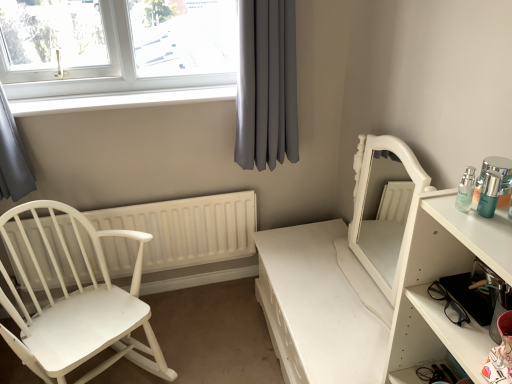
Measure the distance between point (x=286, y=155) and camera.

Point (x=286, y=155) is 1.84 meters away from camera.

Image resolution: width=512 pixels, height=384 pixels. Find the location of `white glossy mirror at right`. white glossy mirror at right is located at coordinates (384, 208).

Measure the distance between point (x=267, y=231) and camera.

The distance of point (x=267, y=231) from camera is 6.66 feet.

This screenshot has width=512, height=384. What are the coordinates of `white glossy window sill at upper left` in the screenshot? It's located at (121, 100).

Where is `white plastic radiator at lower left`? This screenshot has height=384, width=512. white plastic radiator at lower left is located at coordinates (187, 229).

Locate an element on the screen. The image size is (512, 384). white glossy shelf at right is located at coordinates (437, 278).

Identify the location of gray fabric curtain at upper center. (266, 85).

Is white wood chair at left positioned beyond the bounds of white glossy shelf at right?

Yes, white wood chair at left is not within white glossy shelf at right.

Considering the sizes of objects white wood chair at left and white glossy shelf at right in the image provided, who is bigger, white wood chair at left or white glossy shelf at right?

white wood chair at left.

From the image's perspective, relative to white glossy shelf at right, is white wood chair at left above or below?

From the image's perspective, white wood chair at left appears below white glossy shelf at right.

Locate an element on the screen. Image resolution: width=512 pixels, height=384 pixels. chair that is behind the white glossy shelf at right is located at coordinates (78, 307).

The height and width of the screenshot is (384, 512). I want to click on curtain to the right of white glossy window sill at upper left, so click(266, 85).

From a real-world perspective, which is physically below, gray fabric curtain at upper center or white glossy window sill at upper left?

In real-world perspective, white glossy window sill at upper left is lower.

Who is shorter, gray fabric curtain at upper center or white glossy window sill at upper left?

With less height is white glossy window sill at upper left.

Based on the photo, is gray fabric curtain at upper center not within white glossy window sill at upper left?

gray fabric curtain at upper center lies outside white glossy window sill at upper left's area.

From a real-world perspective, is white glossy vanity at center right on top of gray fabric curtain at upper center?

No, from a real-world perspective, white glossy vanity at center right is not above gray fabric curtain at upper center.

What are the coordinates of `curtain that appears on the left of white glossy vanity at center right` in the screenshot? It's located at (266, 85).

From the image's perspective, who appears lower, white glossy vanity at center right or gray fabric curtain at upper center?

From the image's view, white glossy vanity at center right is below.

Is white glossy vanity at center right taller or shorter than gray fabric curtain at upper center?

Clearly, white glossy vanity at center right is shorter compared to gray fabric curtain at upper center.

From a real-world perspective, between white plastic radiator at lower left and white plastic window at upper left, who is vertically lower?

white plastic radiator at lower left.

Looking at their sizes, would you say white plastic radiator at lower left is wider or thinner than white plastic window at upper left?

Considering their sizes, white plastic radiator at lower left looks slimmer than white plastic window at upper left.

Which point is more distant from viewer, (83, 275) or (165, 56)?

The point (83, 275) is farther from the camera.

Based on the photo, is white plastic window at upper left outside of matte glass bottles at right?

Yes, white plastic window at upper left is located beyond the bounds of matte glass bottles at right.

What's the angular difference between white plastic window at upper left and matte glass bottles at right's facing directions?

They differ by 89.7 degrees in their facing directions.

In the scene shown: From a real-world perspective, is white plastic window at upper left positioned above or below matte glass bottles at right?

white plastic window at upper left is situated higher than matte glass bottles at right in the real world.

Is matte glass bottles at right inside or outside of white plastic radiator at lower left?

matte glass bottles at right is not inside white plastic radiator at lower left, it's outside.

Are matte glass bottles at right and white plastic radiator at lower left beside each other?

No, matte glass bottles at right is not beside white plastic radiator at lower left.

I want to click on toiletry in front of the white plastic radiator at lower left, so click(494, 184).

Can you confirm if white glossy vanity at center right is shorter than white plastic radiator at lower left?

Indeed, white glossy vanity at center right has a lesser height compared to white plastic radiator at lower left.

Based on the photo, in terms of width, does white glossy vanity at center right look wider or thinner when compared to white plastic radiator at lower left?

Considering their sizes, white glossy vanity at center right looks broader than white plastic radiator at lower left.

Identify the location of vanity located underneath the white plastic radiator at lower left (from a real-world perspective). (316, 308).

Measure the distance between white glossy vanity at center right and white plastic radiator at lower left.

white glossy vanity at center right and white plastic radiator at lower left are 22.88 inches apart from each other.

Where is `shelf on the right of white wood chair at left`? The height and width of the screenshot is (384, 512). shelf on the right of white wood chair at left is located at coordinates (437, 278).

You are a GUI agent. You are given a task and a screenshot of the screen. Output one action in this format:
    pyautogui.click(x=<x>, y=<y>)
    Task: Click on the window sill that appears on the left of gray fabric curtain at upper center
    
    Given the screenshot: What is the action you would take?
    pyautogui.click(x=121, y=100)

Based on their spatial positions, is white glossy shelf at right or white glossy vanity at center right further from gray fabric curtain at upper center?

Based on the image, white glossy shelf at right appears to be further to gray fabric curtain at upper center.

From the image, which object appears to be farther from gray fabric curtain at upper center, white plastic radiator at lower left or white glossy window sill at upper left?

white plastic radiator at lower left lies further to gray fabric curtain at upper center than the other object.

Which object lies nearer to the anchor point white glossy shelf at right, gray fabric curtain at upper center or white wood chair at left?

gray fabric curtain at upper center is closer to white glossy shelf at right.

Looking at the image, which one is located closer to white wood chair at left, white glossy mirror at right or white glossy window sill at upper left?

The object closer to white wood chair at left is white glossy window sill at upper left.

Looking at the image, which one is located further to white glossy shelf at right, white glossy window sill at upper left or white glossy mirror at right?

Based on the image, white glossy window sill at upper left appears to be further to white glossy shelf at right.

Looking at the image, which one is located further to white glossy vanity at center right, white glossy mirror at right or white plastic radiator at lower left?

The object further to white glossy vanity at center right is white plastic radiator at lower left.

Looking at the image, which one is located closer to gray fabric curtain at upper center, white wood chair at left or matte glass bottles at right?

The object closer to gray fabric curtain at upper center is white wood chair at left.

Which object lies further to the anchor point matte glass bottles at right, white glossy vanity at center right or white glossy mirror at right?

white glossy vanity at center right is positioned further to the anchor matte glass bottles at right.

Find the location of a particular element. The width and height of the screenshot is (512, 384). the back located between white glossy shelf at right and white glossy vanity at center right in the depth direction is located at coordinates (384, 208).

Where is `window sill between white plastic window at upper left and white plastic radiator at lower left from top to bottom`? Image resolution: width=512 pixels, height=384 pixels. window sill between white plastic window at upper left and white plastic radiator at lower left from top to bottom is located at coordinates (121, 100).

Identify the location of the back situated between white glossy window sill at upper left and matte glass bottles at right from left to right. (384, 208).

Identify the location of the back situated between white plastic radiator at lower left and white glossy shelf at right from left to right. The image size is (512, 384). (384, 208).